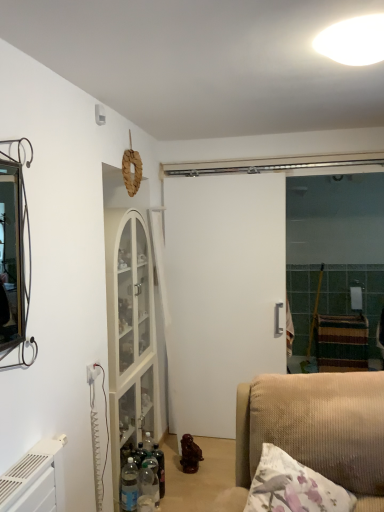
Question: Considering the positions of translucent plastic bottles at lower left, acting as the second bottle starting from the back, and white matte door at center in the image, is translucent plastic bottles at lower left, acting as the second bottle starting from the back, taller or shorter than white matte door at center?

Choices:
 (A) short
 (B) tall

Answer: (A)

Question: From a real-world perspective, is translucent plastic bottles at lower left, the second bottle from the front, positioned above or below white matte door at center?

Choices:
 (A) below
 (B) above

Answer: (A)

Question: Which object is positioned farthest from the translucent plastic bottle at lower center, the 1th bottle positioned from the front?

Choices:
 (A) translucent plastic bottles at lower left, acting as the second bottle starting from the back
 (B) translucent glass bottle at center, marked as the first bottle in a back-to-front arrangement
 (C) white glossy light fixture at upper center
 (D) fluffy white pillow at lower right
 (E) white matte door at center

Answer: (C)

Question: Which of these objects is positioned closest to the white matte door at center?

Choices:
 (A) translucent plastic bottles at lower left, the second bottle from the front
 (B) fluffy white pillow at lower right
 (C) white glossy light fixture at upper center
 (D) translucent plastic bottle at lower center, the 1th bottle positioned from the front
 (E) translucent glass bottle at center, positioned as the third bottle in front-to-back order

Answer: (E)